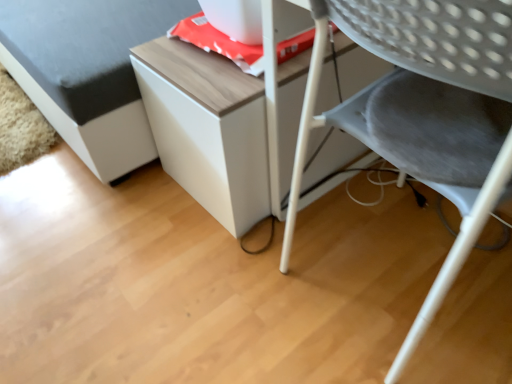
Find the location of a particular element. Image resolution: width=512 pixels, height=384 pixels. vacant space situated on the left part of wooden table at center is located at coordinates (112, 211).